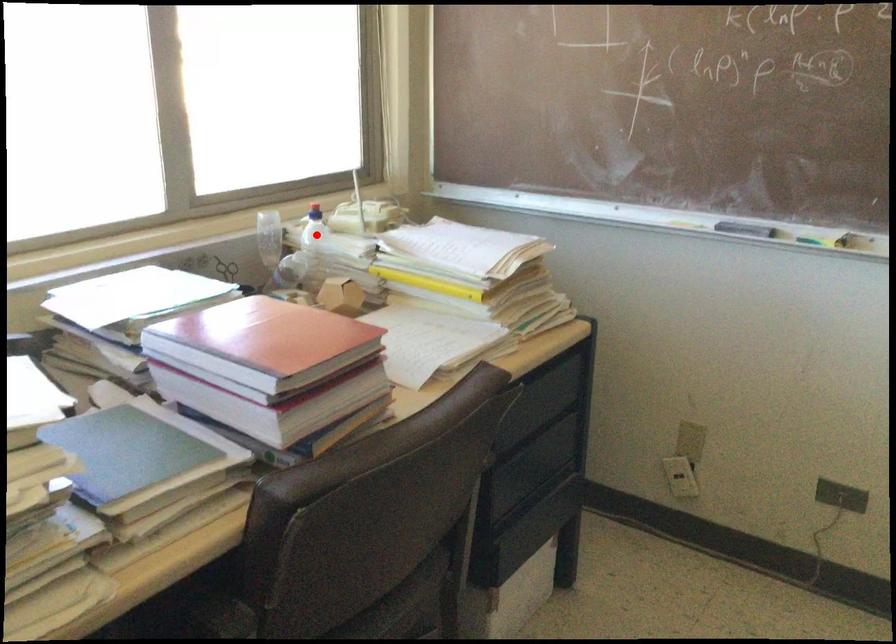
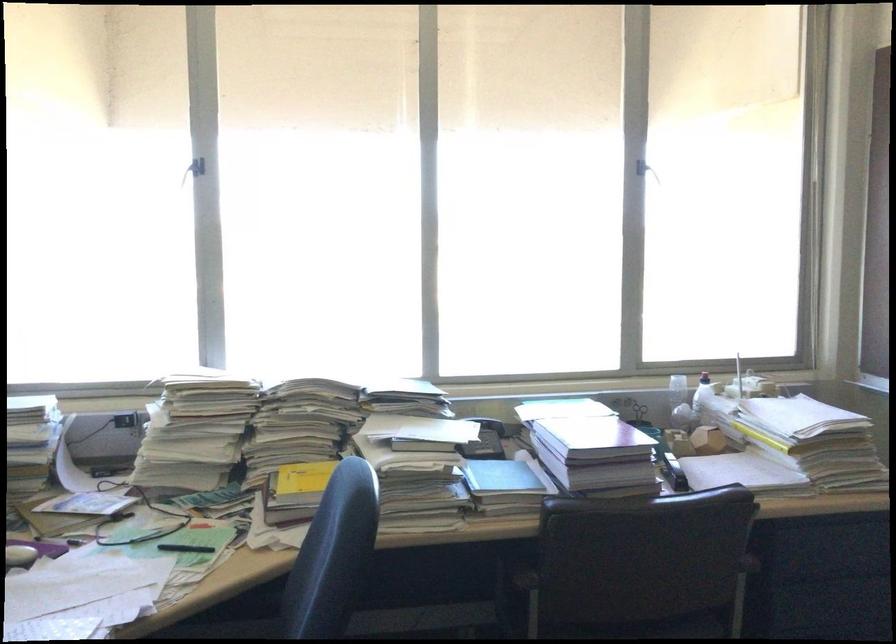
Question: I am providing you with two images of the same scene from different viewpoints. A red point is shown in image1. For the corresponding object point in image2, is it positioned nearer or farther from the camera?

Choices:
 (A) Nearer
 (B) Farther

Answer: (B)